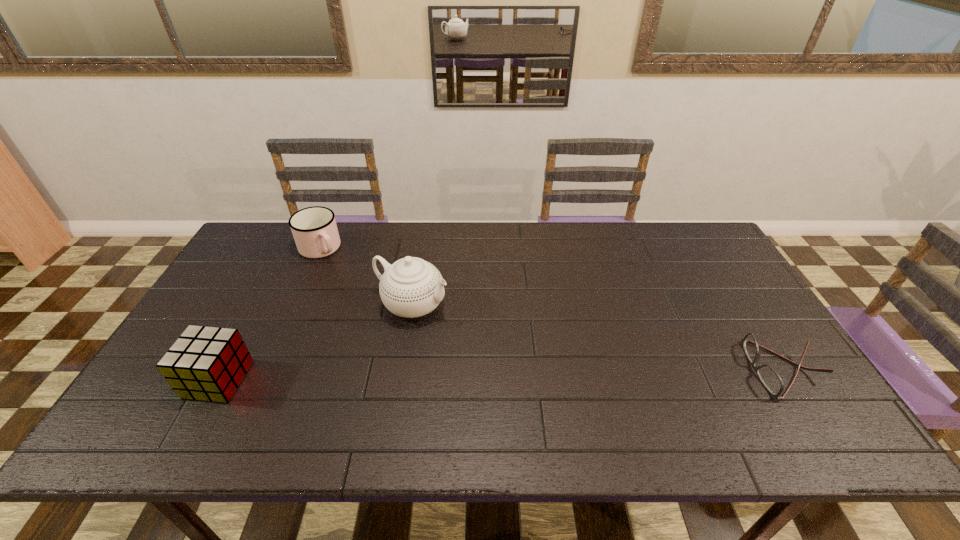
The image size is (960, 540). I want to click on vacant space that satisfies the following two spatial constraints: 1. on the front side of the third object from left to right; 2. on the front-facing side of the rightmost object, so click(401, 369).

Identify the location of vacant space that satisfies the following two spatial constraints: 1. on the front side of the second object from right to left; 2. on the front-facing side of the shortest object. (401, 369).

The width and height of the screenshot is (960, 540). What are the coordinates of `free region that satisfies the following two spatial constraints: 1. on the front side of the second farthest object; 2. on the right side of the mug` in the screenshot? It's located at (295, 305).